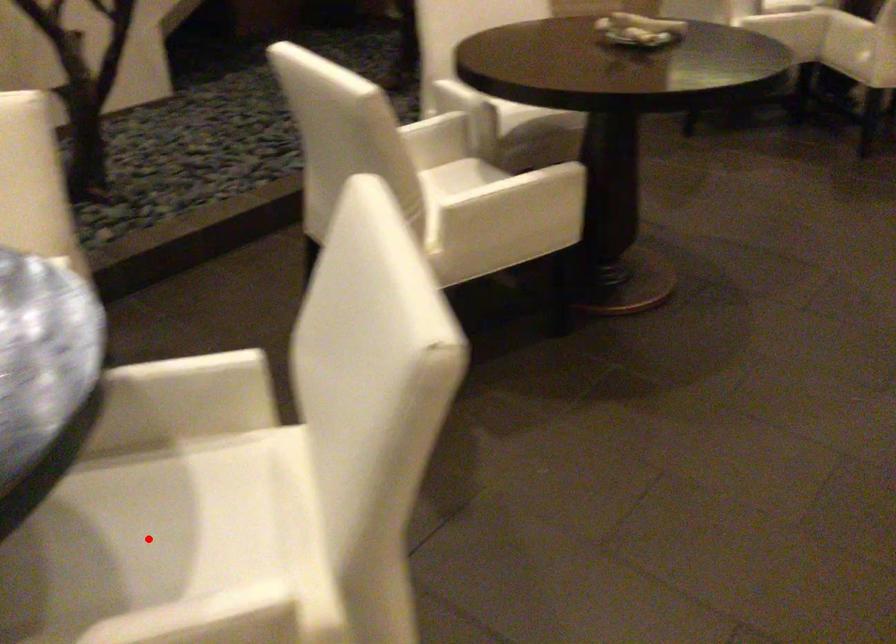
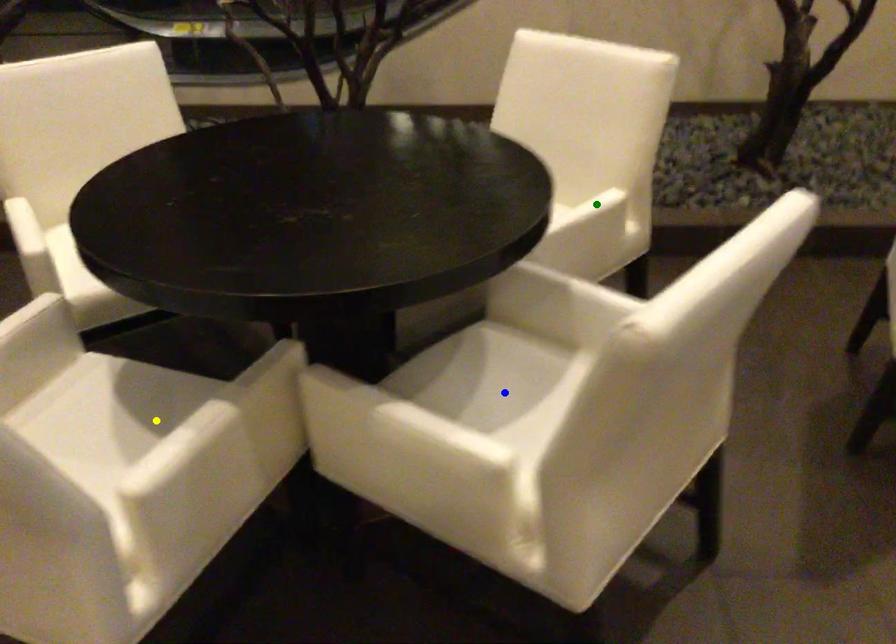
Question: I am providing you with two images of the same scene from different viewpoints. A red point is marked on the first image. You are given multiple points on the second image. Can you choose the point in image 2 that corresponds to the point in image 1?

Choices:
 (A) blue point
 (B) green point
 (C) yellow point

Answer: (A)